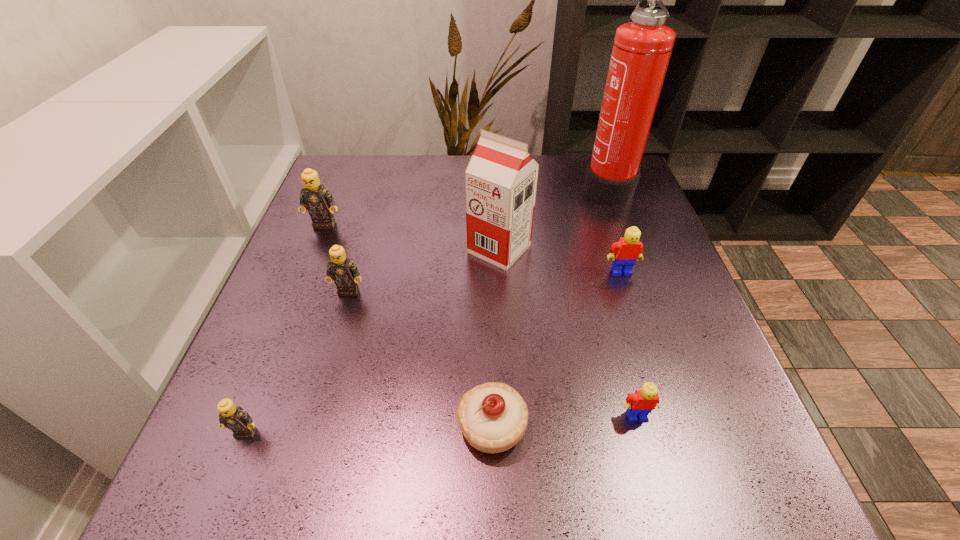
The image size is (960, 540). What are the coordinates of `the smaller yellow Lego` in the screenshot? It's located at (642, 402).

This screenshot has width=960, height=540. Find the location of `the smallest tan Lego`. the smallest tan Lego is located at coordinates (233, 417).

Where is `the nearest Lego`? the nearest Lego is located at coordinates (233, 417).

This screenshot has height=540, width=960. In order to click on pastry in this screenshot , I will do `click(493, 417)`.

Where is `free space located 0.290m on the front-facing side of the fire extinguisher`? The height and width of the screenshot is (540, 960). free space located 0.290m on the front-facing side of the fire extinguisher is located at coordinates (473, 185).

Locate an element on the screen. vacant space located 0.310m on the front-facing side of the fire extinguisher is located at coordinates (467, 185).

You are a GUI agent. You are given a task and a screenshot of the screen. Output one action in this format:
    pyautogui.click(x=<x>, y=<y>)
    Task: Click on the vacant position located on the front-facing side of the fire extinguisher
    The width and height of the screenshot is (960, 540).
    Given the screenshot: What is the action you would take?
    pyautogui.click(x=473, y=185)

Locate an element on the screen. The width and height of the screenshot is (960, 540). free space located on the front of the soya milk is located at coordinates (503, 338).

This screenshot has height=540, width=960. I want to click on vacant space located 0.370m in front of the sixth shortest object, so click(271, 359).

You are a GUI agent. You are given a task and a screenshot of the screen. Output one action in this format:
    pyautogui.click(x=<x>, y=<y>)
    Task: Click on the blank space located 0.150m on the front-facing side of the second farthest Lego
    The height and width of the screenshot is (540, 960).
    Given the screenshot: What is the action you would take?
    pyautogui.click(x=640, y=332)